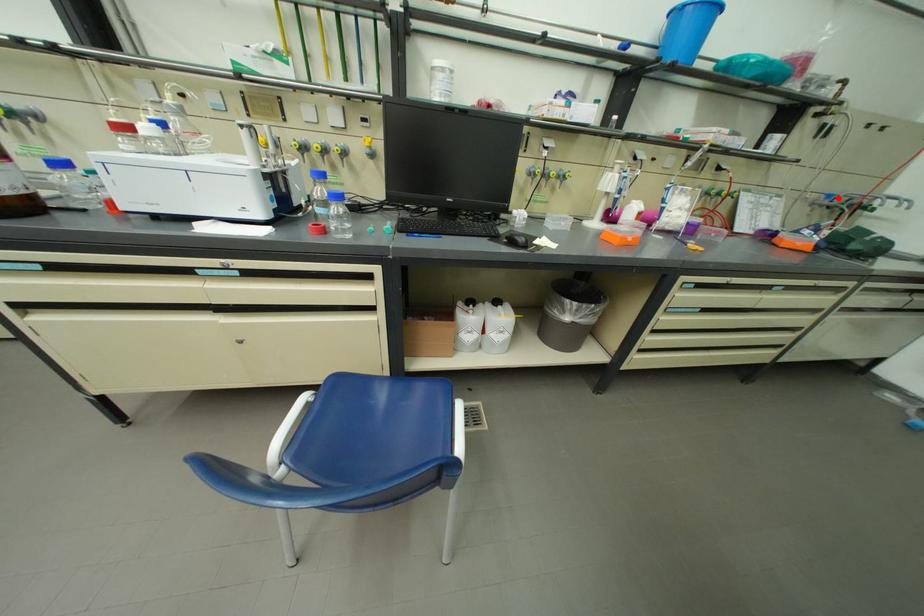
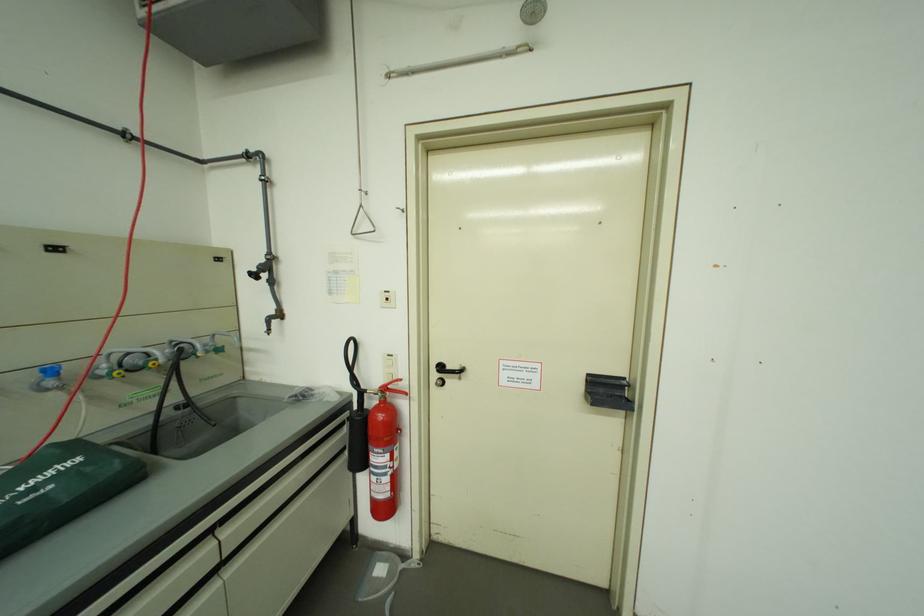
Question: I am providing you with two images of the same scene from different viewpoints. Given a red point in image1, look at the same physical point in image2. Is it:

Choices:
 (A) Closer to the viewpoint
 (B) Farther from the viewpoint

Answer: (A)